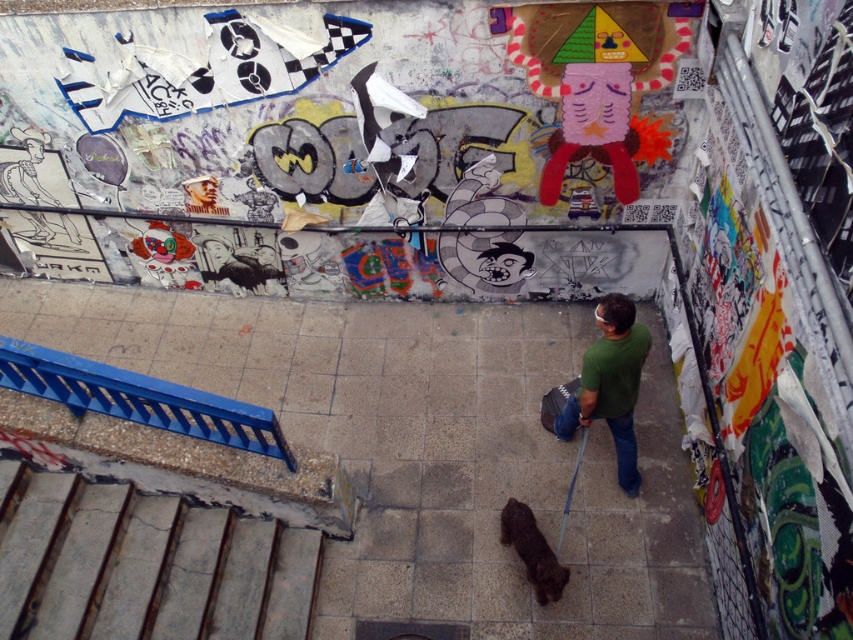
Who is positioned more to the left, green matte shirt at center or shiny brown fur at center?

→ shiny brown fur at center is more to the left.

Who is taller, green matte shirt at center or shiny brown fur at center?

With more height is green matte shirt at center.

The width and height of the screenshot is (853, 640). Describe the element at coordinates (610, 384) in the screenshot. I see `green matte shirt at center` at that location.

The width and height of the screenshot is (853, 640). In order to click on green matte shirt at center in this screenshot , I will do `click(610, 384)`.

Looking at this image, between shiny brown fur at center and blue fabric leash at lower center, which one is positioned higher?

blue fabric leash at lower center is above.

Which is more to the left, shiny brown fur at center or blue fabric leash at lower center?

shiny brown fur at center is more to the left.

The image size is (853, 640). Describe the element at coordinates (532, 552) in the screenshot. I see `shiny brown fur at center` at that location.

Where is `shiny brown fur at center`? The image size is (853, 640). shiny brown fur at center is located at coordinates (532, 552).

Who is positioned more to the right, green matte shirt at center or blue fabric leash at lower center?

green matte shirt at center is more to the right.

Who is more forward, (607, 403) or (585, 436)?

Point (607, 403) is in front.

Does point (618, 292) come closer to viewer compared to point (576, 460)?

That is False.

This screenshot has width=853, height=640. Identify the location of green matte shirt at center. (610, 384).